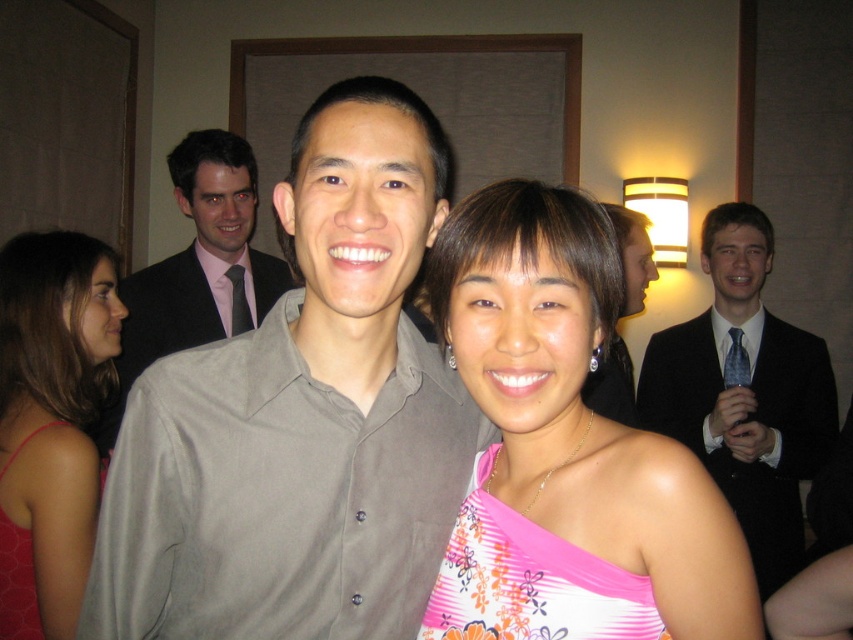
Is the position of shiny black suit at right less distant than that of gray matte shirt at center?

No, shiny black suit at right is further to the viewer.

Measure the distance between shiny black suit at right and camera.

shiny black suit at right and camera are 7.82 feet apart from each other.

I want to click on shiny black suit at right, so click(746, 392).

Can you confirm if matte gray shirt at center is smaller than gray matte shirt at center?

Correct, matte gray shirt at center occupies less space than gray matte shirt at center.

Can you confirm if matte gray shirt at center is bigger than gray matte shirt at center?

Incorrect, matte gray shirt at center is not larger than gray matte shirt at center.

What do you see at coordinates (300, 419) in the screenshot? The width and height of the screenshot is (853, 640). I see `matte gray shirt at center` at bounding box center [300, 419].

Locate an element on the screen. The height and width of the screenshot is (640, 853). matte gray shirt at center is located at coordinates (300, 419).

Between pink floral dress at center and gray matte shirt at center, which one is positioned lower?

pink floral dress at center is below.

Where is `pink floral dress at center`? pink floral dress at center is located at coordinates (566, 449).

Is point (566, 604) closer to camera compared to point (148, 275)?

Yes, it is.

Image resolution: width=853 pixels, height=640 pixels. What are the coordinates of `pink floral dress at center` in the screenshot? It's located at (566, 449).